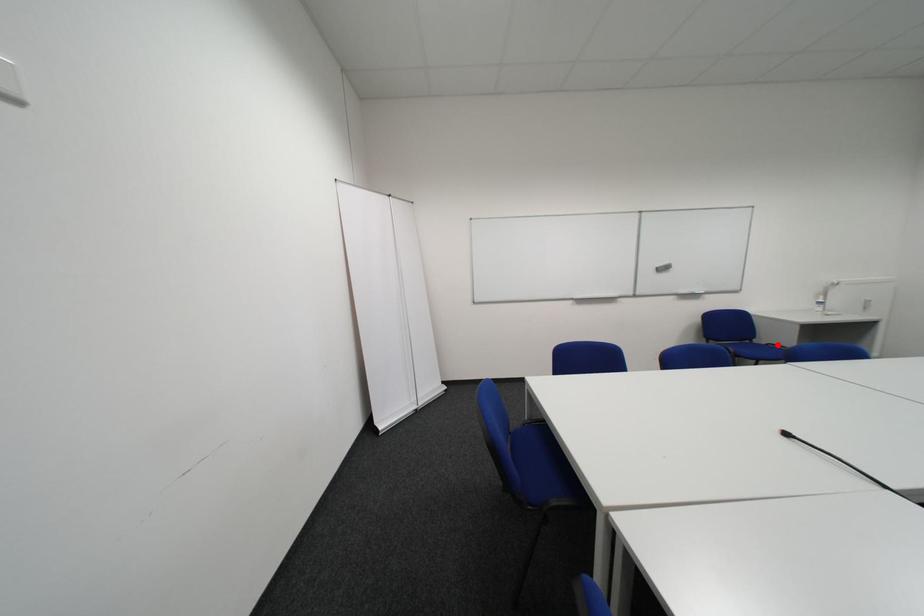
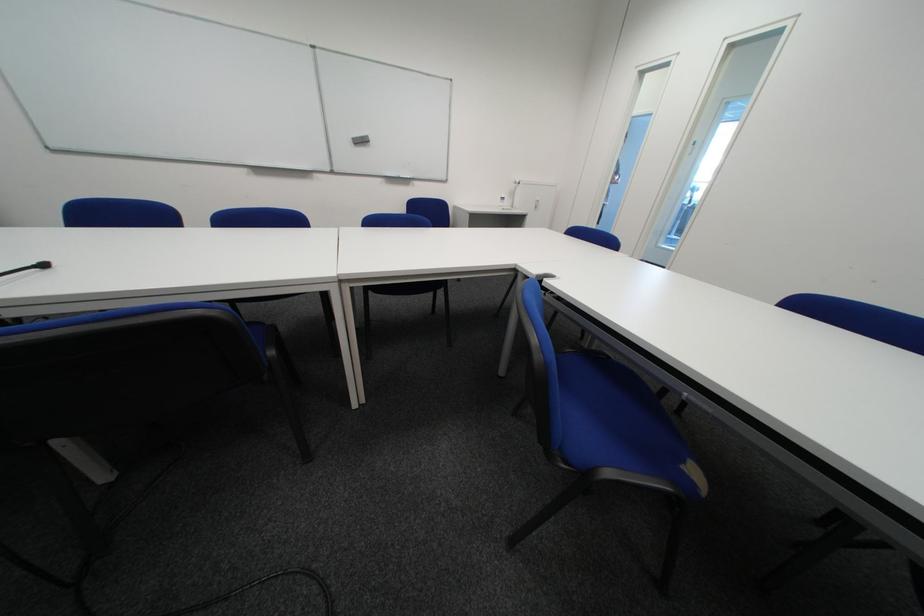
Question: I am providing you with two images of the same scene from different viewpoints. A red point is marked on the first image. Is the red point's position out of view in image 2?

Choices:
 (A) Yes
 (B) No

Answer: (A)